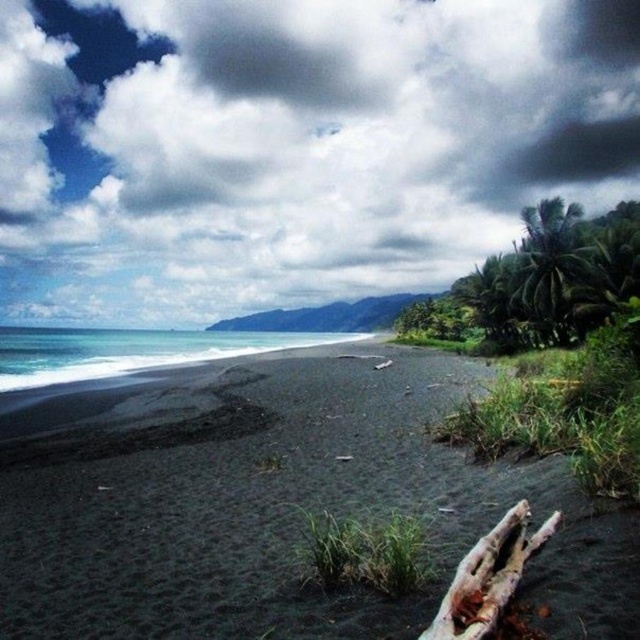
What are the coordinates of the black sand beach at center in the image?

The black sand beach at center is located at coordinates point (285, 509).

You are standing on the beach and looking at the cloudy sky at upper center and the brown wood log at lower right. Which object is located to the right of the other?

The brown wood log at lower right is located to the right of the cloudy sky at upper center.

You are a photographer planning to capture the cloudy sky at upper center and the black sand beach at center in a single frame. Which of these two elements will occupy more horizontal space in your photo?

The cloudy sky at upper center will occupy more horizontal space in the photo because its width is larger than that of the black sand beach at center.